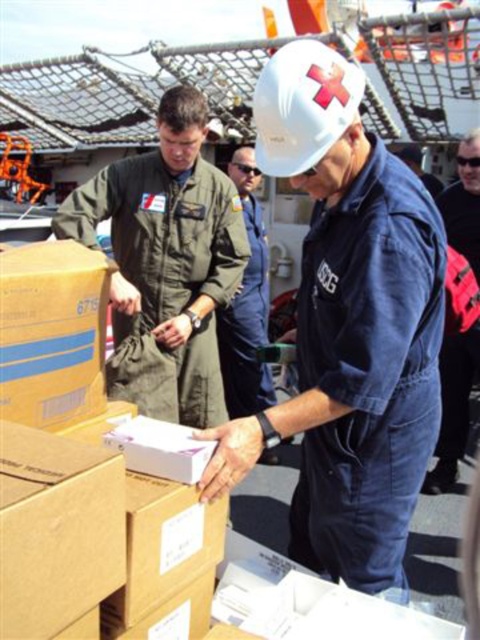
You are an emergency responder needing to access the yellow cardboard box at lower left and the blue denim jumpsuit at center. Which object is closer to the ground?

The yellow cardboard box at lower left is shorter than the blue denim jumpsuit at center, so it is closer to the ground.

What are the coordinates of the yellow cardboard box at lower left?

The yellow cardboard box at lower left is located at coordinates point (x=51, y=333).